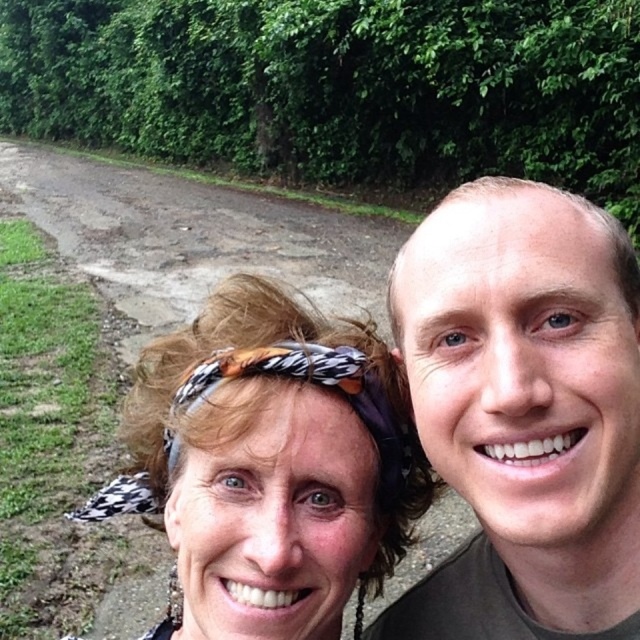
Question: Is smooth skin face at right above printed fabric headscarf at center?

Choices:
 (A) yes
 (B) no

Answer: (B)

Question: Is smooth skin face at right behind printed fabric headscarf at center?

Choices:
 (A) yes
 (B) no

Answer: (B)

Question: Among these points, which one is farthest from the camera?

Choices:
 (A) (545, 364)
 (B) (394, 433)
 (C) (288, 330)

Answer: (B)

Question: Does smooth skin face at right have a greater width compared to matte black headband at center?

Choices:
 (A) no
 (B) yes

Answer: (A)

Question: Which is nearer to the printed fabric headscarf at center?

Choices:
 (A) smooth skin face at right
 (B) matte black headband at center

Answer: (B)

Question: Among these objects, which one is farthest from the camera?

Choices:
 (A) printed fabric headscarf at center
 (B) matte black headband at center

Answer: (A)